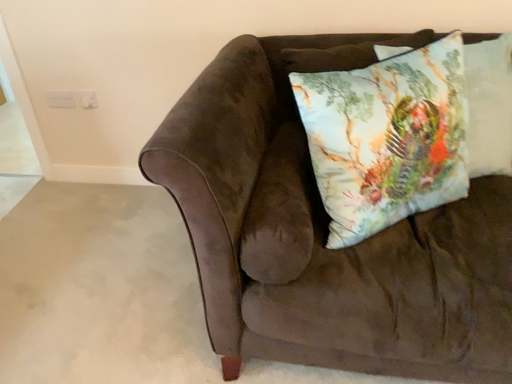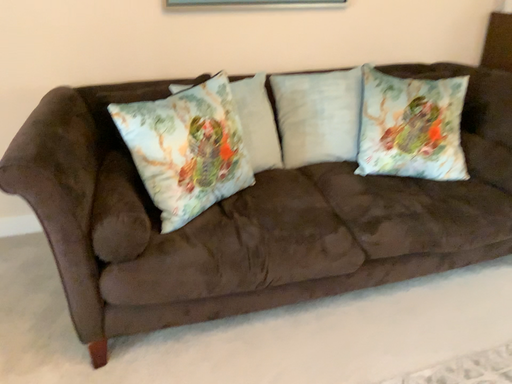
Question: How did the camera likely rotate when shooting the video?

Choices:
 (A) rotated upward
 (B) rotated downward

Answer: (A)